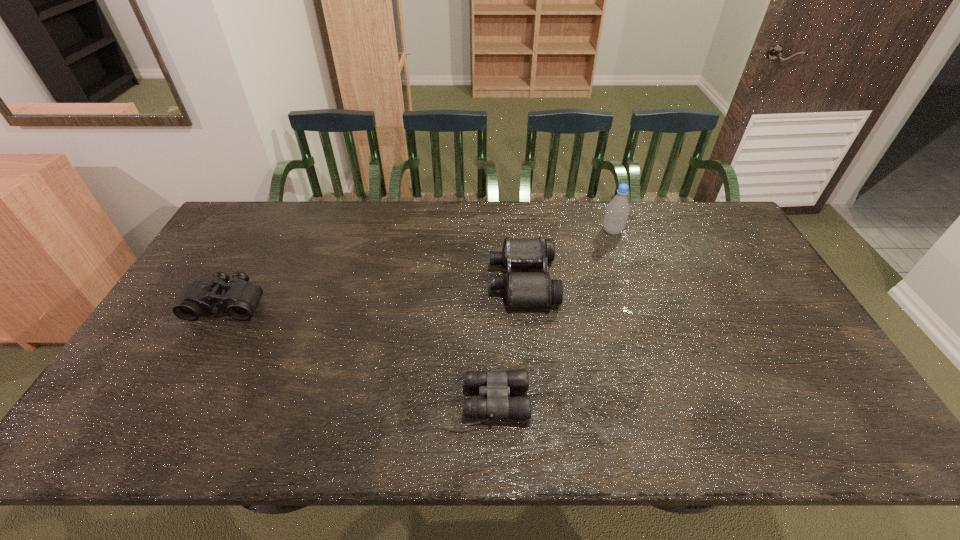
At what (x,y) coordinates should I click in order to perform the action: click on empty space that is in between the leftmost binoculars and the nearest object. Please return your answer as a coordinate pair (x, y). The height and width of the screenshot is (540, 960). Looking at the image, I should click on (347, 353).

Find the location of a particular element. This screenshot has width=960, height=540. free space between the leftmost binoculars and the rightmost object is located at coordinates tap(420, 267).

Find the location of a particular element. Image resolution: width=960 pixels, height=540 pixels. blank region between the leftmost object and the farthest object is located at coordinates (420, 267).

At what (x,y) coordinates should I click in order to perform the action: click on free space between the leftmost binoculars and the shortest binoculars. Please return your answer as a coordinate pair (x, y). Looking at the image, I should click on (347, 353).

Identify the location of vacant space that is in between the leftmost binoculars and the farthest object. (420, 267).

Identify the location of free spot between the nearest object and the farthest object. Image resolution: width=960 pixels, height=540 pixels. (540, 317).

Locate which object ranks second in proximity to the leftmost binoculars. Please provide its 2D coordinates. Your answer should be formatted as a tuple, i.e. [(x, y)], where the tuple contains the x and y coordinates of a point satisfying the conditions above.

[(520, 288)]

What are the coordinates of `object that ranks as the second closest to the leftmost binoculars` in the screenshot? It's located at (520, 288).

Image resolution: width=960 pixels, height=540 pixels. Find the location of `the second closest binoculars to the leftmost binoculars`. the second closest binoculars to the leftmost binoculars is located at coordinates (520, 288).

This screenshot has height=540, width=960. Identify the location of binoculars that is the second nearest to the rightmost object. (496, 385).